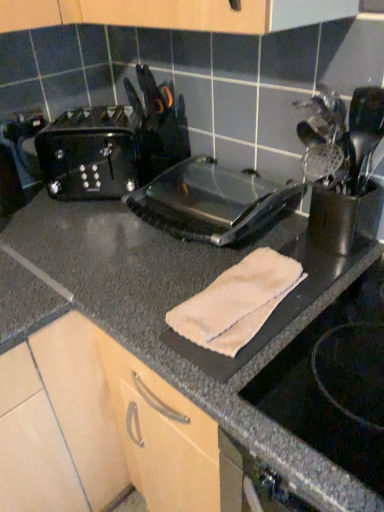
This screenshot has width=384, height=512. Identify the location of spots to the right of beige cotton towel at center. (339, 316).